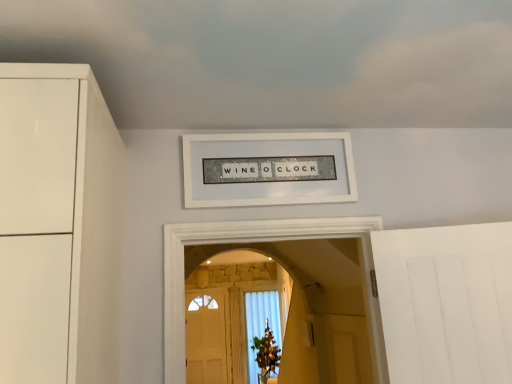
Question: Which is correct: white matte cloud at upper center is inside white glittery sign at center, or outside of it?

Choices:
 (A) inside
 (B) outside

Answer: (B)

Question: From the image's perspective, relative to white glittery sign at center, is white matte cloud at upper center above or below?

Choices:
 (A) below
 (B) above

Answer: (B)

Question: Is white matte cloud at upper center in front of or behind white glittery sign at center in the image?

Choices:
 (A) front
 (B) behind

Answer: (A)

Question: In terms of size, does white glittery sign at center appear bigger or smaller than white matte cloud at upper center?

Choices:
 (A) small
 (B) big

Answer: (A)

Question: In terms of width, does white glittery sign at center look wider or thinner when compared to white matte cloud at upper center?

Choices:
 (A) thin
 (B) wide

Answer: (A)

Question: Considering the positions of white glittery sign at center and white matte cloud at upper center in the image, is white glittery sign at center taller or shorter than white matte cloud at upper center?

Choices:
 (A) tall
 (B) short

Answer: (A)

Question: Based on their positions, is white glittery sign at center located to the left or right of white matte cloud at upper center?

Choices:
 (A) left
 (B) right

Answer: (A)